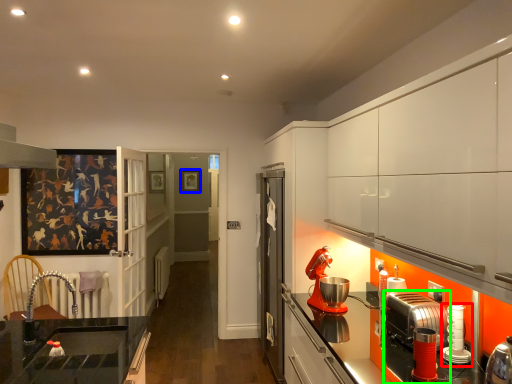
Question: Considering the real-world distances, which object is closest to kitchen appliance (highlighted by a red box)? picture frame (highlighted by a blue box) or kitchen appliance (highlighted by a green box).

Choices:
 (A) picture frame
 (B) kitchen appliance

Answer: (B)